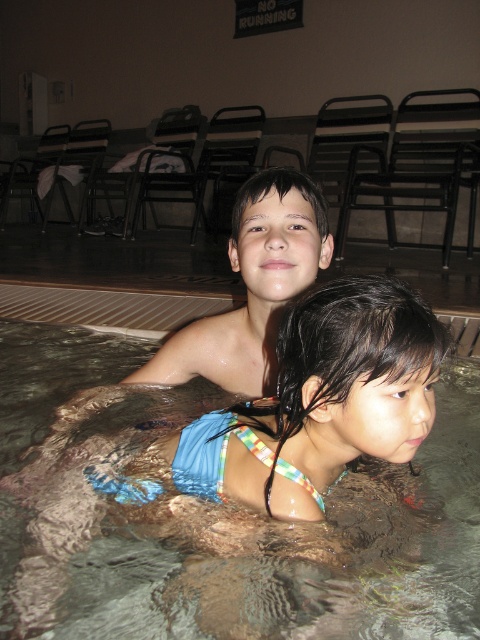
Question: Does clear plastic water at upper center have a lesser width compared to smooth skin boy at upper center?

Choices:
 (A) no
 (B) yes

Answer: (A)

Question: Where is clear plastic water at upper center located in relation to smooth skin boy at upper center in the image?

Choices:
 (A) right
 (B) left

Answer: (B)

Question: Which point is farther to the camera?

Choices:
 (A) smooth skin boy at upper center
 (B) clear plastic water at upper center

Answer: (A)

Question: From the image, what is the correct spatial relationship of clear plastic water at upper center in relation to smooth skin boy at upper center?

Choices:
 (A) left
 (B) right

Answer: (A)

Question: Which object is closer to the camera taking this photo?

Choices:
 (A) clear plastic water at upper center
 (B) smooth skin boy at upper center

Answer: (A)